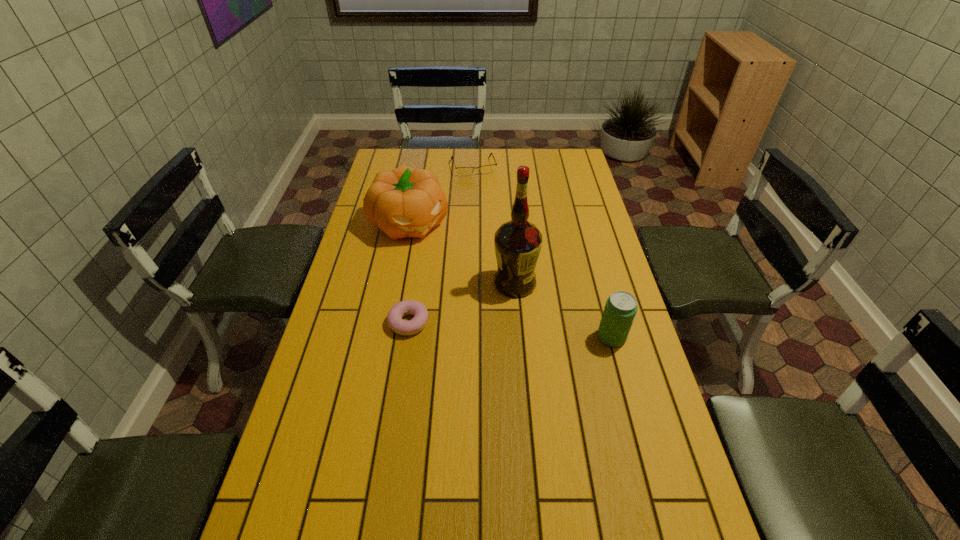
Image resolution: width=960 pixels, height=540 pixels. I want to click on doughnut, so click(394, 318).

I want to click on soda, so click(x=619, y=312).

Locate an element on the screen. the third tallest object is located at coordinates (619, 312).

Image resolution: width=960 pixels, height=540 pixels. What are the coordinates of `pumpkin` in the screenshot? It's located at (405, 202).

You are a GUI agent. You are given a task and a screenshot of the screen. Output one action in this format:
    pyautogui.click(x=<x>, y=<y>)
    Task: Click on the fourth nearest object
    This screenshot has width=960, height=540.
    Given the screenshot: What is the action you would take?
    pyautogui.click(x=405, y=202)

You are a GUI agent. You are given a task and a screenshot of the screen. Output one action in this format:
    pyautogui.click(x=<x>, y=<y>)
    Task: Click on the farthest object
    The width and height of the screenshot is (960, 540).
    Given the screenshot: What is the action you would take?
    pyautogui.click(x=487, y=169)

Locate an element on the screen. Image resolution: width=960 pixels, height=540 pixels. the third farthest object is located at coordinates (518, 242).

The height and width of the screenshot is (540, 960). I want to click on alcohol, so click(518, 242).

Image resolution: width=960 pixels, height=540 pixels. I want to click on vacant space located 0.250m on the right of the doughnut, so click(514, 323).

I want to click on blank space located 0.170m on the left of the soda, so click(x=538, y=338).